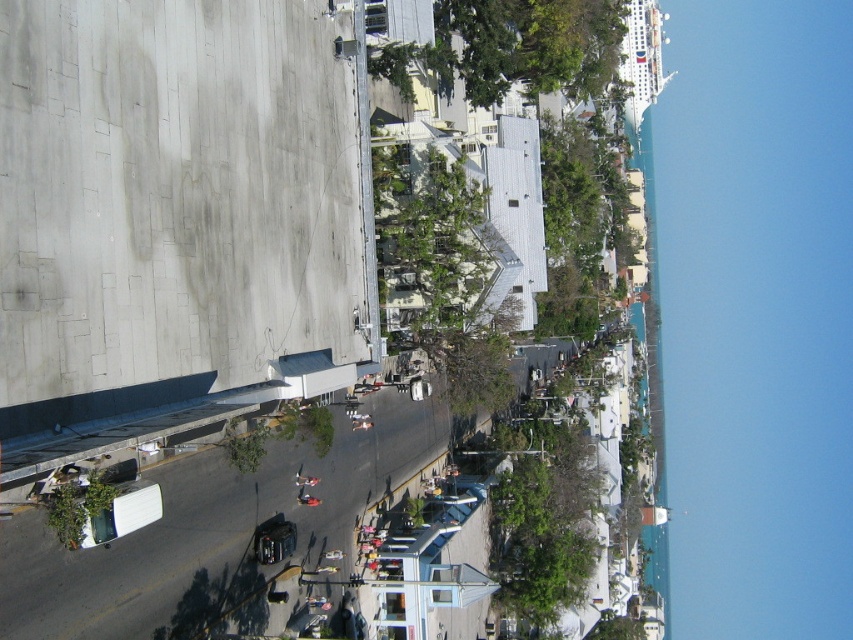
You are standing at the elevated vantage point looking down at the street scene. You notice two points marked on the ground below. The first is at coordinates point (x=469, y=29) and the second is at point (x=469, y=253). Which of these two points is closer to your current position?

Point (x=469, y=29) is further to the camera than point (x=469, y=253), so the point closer to your current position is point (x=469, y=253).

You are standing at the point marked as point (511, 48). Looking around, you see a green leafy tree at upper center. Which direction should you face to see the green leafy tree at upper center?

You should face the upper center direction to see the green leafy tree at upper center located at point (511, 48).

You are standing on a bridge overlooking the street scene. You notice two green leafy trees in the image. Which tree, the green leafy tree at upper center or the green leafy tree at center, appears larger?

The green leafy tree at upper center appears larger than the green leafy tree at center.